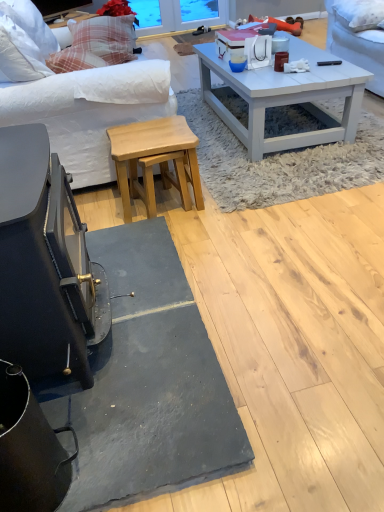
Locate an element on the screen. vacant space to the right of matte blue cup at center, positioned as the 2th coffee cup in right-to-left order is located at coordinates (267, 73).